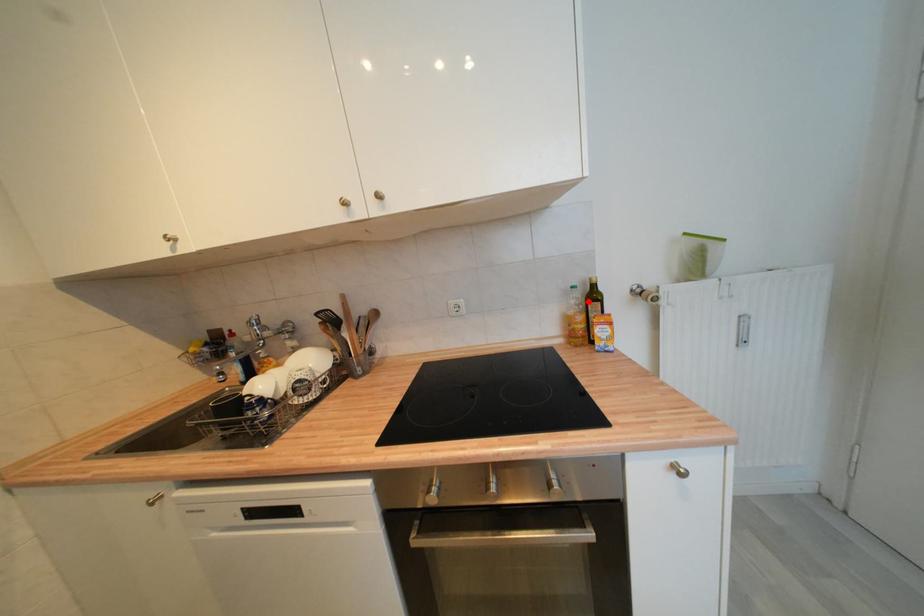
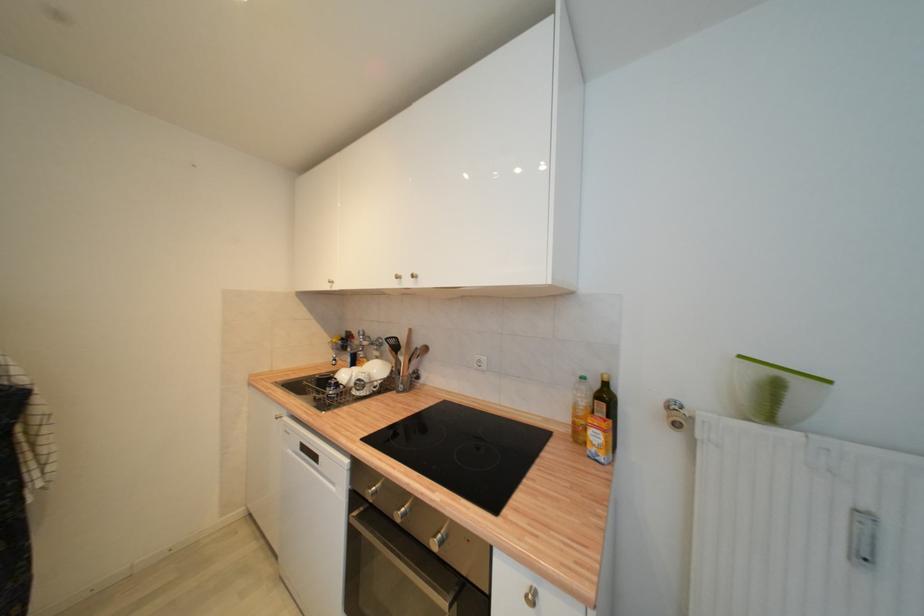
Find the pixel in the second image that matches the highlighted location in the first image.

(596, 397)